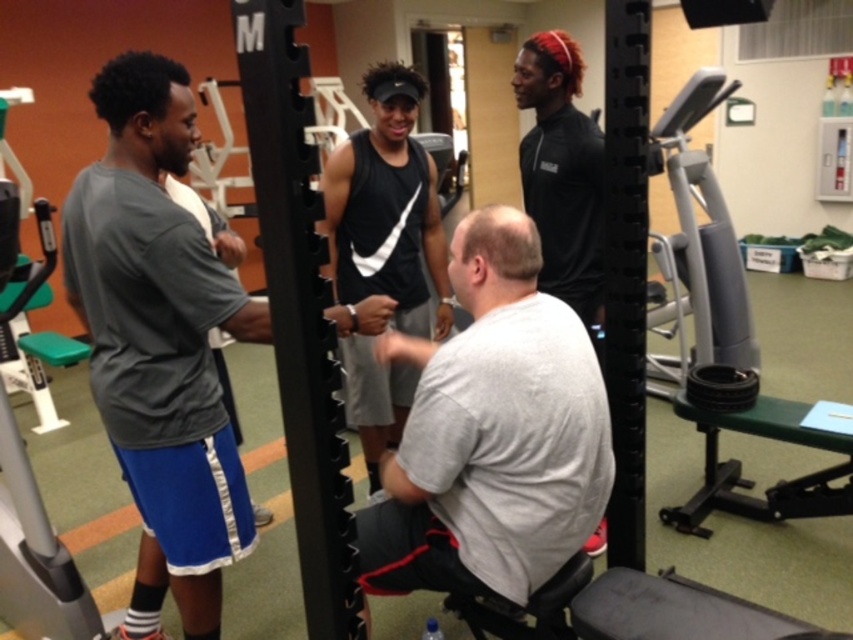
You are standing at the point labeled as point (x=146, y=248) in the gym. You want to take a photo of the entire weightlifting station which is 3 meters wide. Can you step back enough to capture the entire station in your camera frame if your camera has a 60 degree field of view?

The point (x=146, y=248) is 1.52 meters away from the camera. To capture a 3 meter wide scene with a 60 degree field of view, the minimum distance required is 2.598 meters. Since 1.52 meters is less than 2.598 meters, you need to step back further to capture the entire weightlifting station.

You are a gym trainer observing the scene. You need to adjust the equipment to ensure safety. Which object, the gray fabric shirt at left or the gray fabric squat at center, should you focus on moving first because it is positioned higher?

The gray fabric shirt at left should be focused on first since it is located above the gray fabric squat at center, making it more accessible for adjustment.

You are a gym trainer observing the scene. You notice two people wearing shirts of different colors. Which shirt, the gray fabric shirt at left or the black matte shirt at upper right, has a larger size?

The gray fabric shirt at left is bigger than the black matte shirt at upper right.